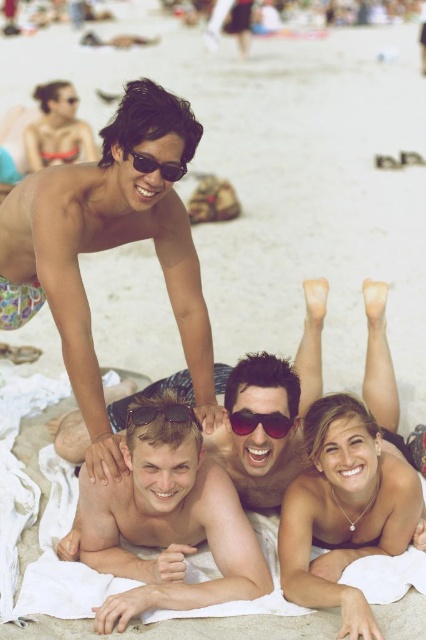
You are a photographer trying to capture a candid shot of the multicolored swim trunks at upper center and the matte sunglasses at center. Since you want to focus on the swim trunks, which object should you prioritize keeping in the foreground of your photo?

The multicolored swim trunks at upper center should be prioritized in the foreground because it is closer to the viewer than the matte sunglasses at center.